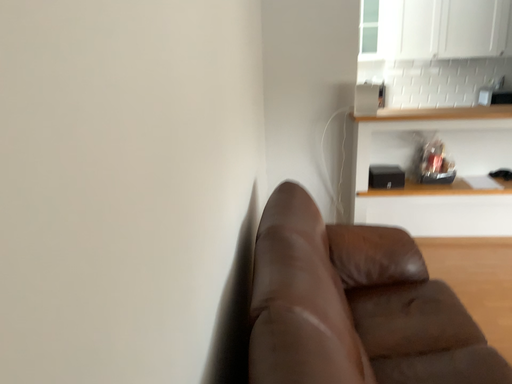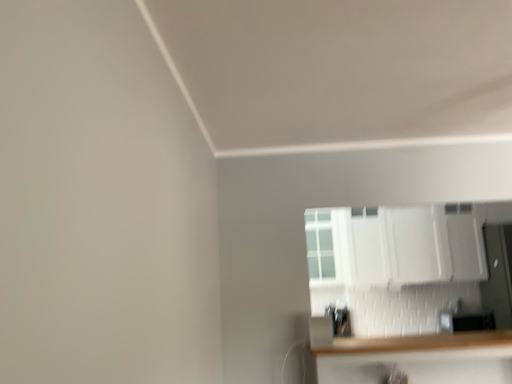
Question: Which way did the camera rotate in the video?

Choices:
 (A) rotated upward
 (B) rotated downward

Answer: (A)